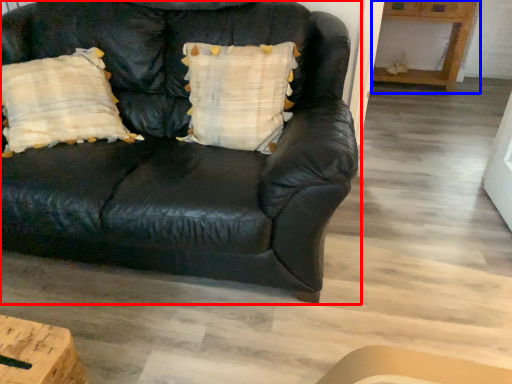
Question: Which object appears closest to the camera in this image, studio couch (highlighted by a red box) or table (highlighted by a blue box)?

Choices:
 (A) studio couch
 (B) table

Answer: (A)